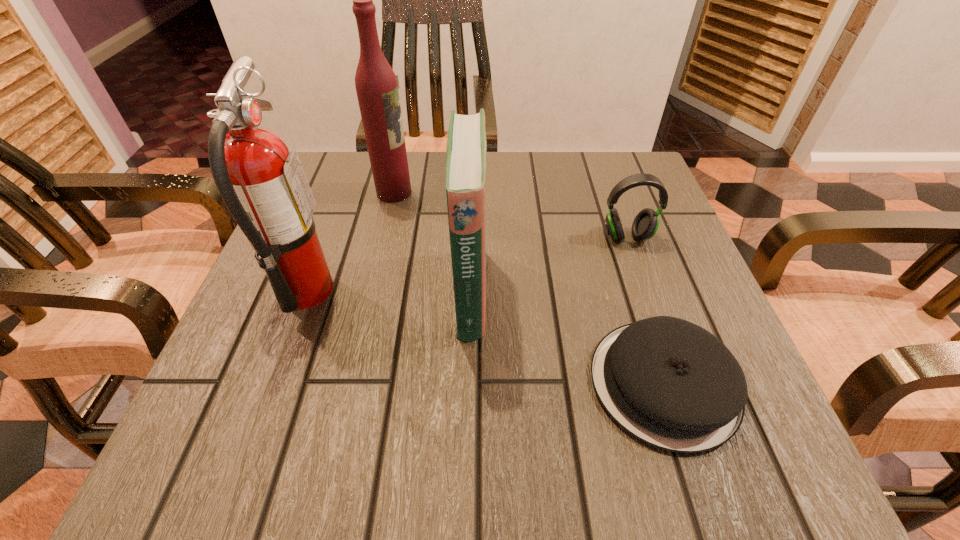
Where is `vacant space located on the cover of the third shortest object`? vacant space located on the cover of the third shortest object is located at coordinates (566, 292).

At what (x,y) coordinates should I click in order to perform the action: click on free spot located 0.180m on the ear cups of the second farthest object. Please return your answer as a coordinate pair (x, y). The height and width of the screenshot is (540, 960). Looking at the image, I should click on (656, 320).

I want to click on free location located on the left of the shortest object, so click(550, 383).

Where is `object that is at the far edge`? object that is at the far edge is located at coordinates (376, 86).

Where is `object that is at the near edge`? object that is at the near edge is located at coordinates [x=670, y=383].

The width and height of the screenshot is (960, 540). I want to click on object that is at the left edge, so click(263, 185).

Find the location of a particular element. headset that is at the right edge is located at coordinates (x=645, y=225).

At what (x,y) coordinates should I click in order to perform the action: click on pancake present at the right edge. Please return your answer as a coordinate pair (x, y). The width and height of the screenshot is (960, 540). Looking at the image, I should click on (670, 383).

Where is `object that is at the near right corner`? The height and width of the screenshot is (540, 960). object that is at the near right corner is located at coordinates (670, 383).

Find the location of `free region at the far edge of the desktop`. free region at the far edge of the desktop is located at coordinates (424, 190).